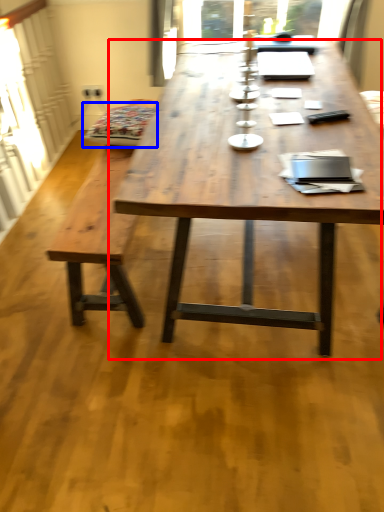
Question: Among these objects, which one is farthest to the camera, coffee table (highlighted by a red box) or swivel chair (highlighted by a blue box)?

Choices:
 (A) coffee table
 (B) swivel chair

Answer: (B)